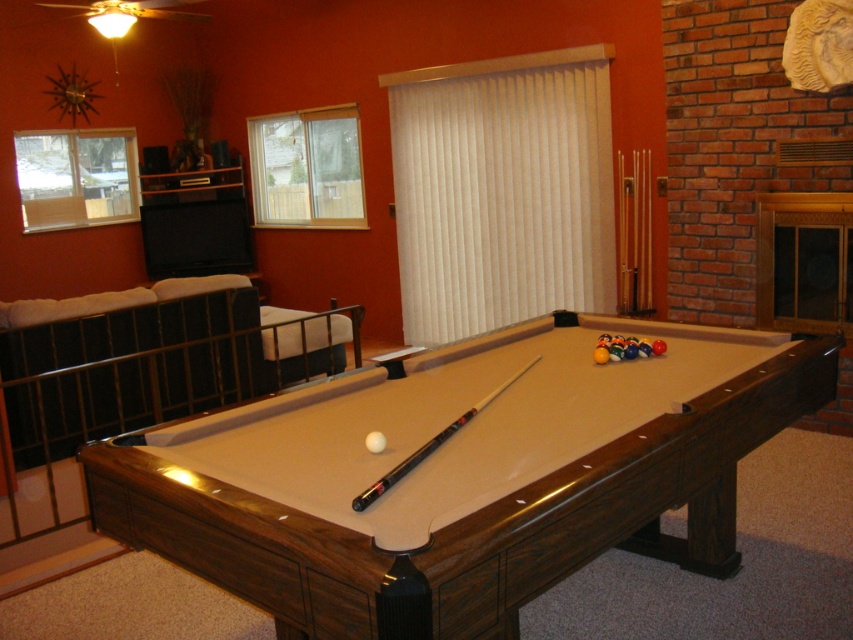
You are standing in the recreational room and want to place a small decorative item on the pool table. You have two options for placement locations, point A at coordinates point (x=389, y=604) and point B at coordinates point (x=520, y=369). Which point is closer to you when viewed from the camera perspective?

Point point (x=389, y=604) is closer to the camera than point point (x=520, y=369), so point A is closer.

You are standing in the recreational room and want to place a 1.5 meter long decorative banner on the floor in front of the brown wood billiard table at center. Can the banner fit entirely in front of the table without overlapping it?

The brown wood billiard table at center is 1.39 meters away from the viewer. Since the banner is 1.5 meters long, it would extend beyond the table, overlapping it. Therefore, the banner cannot fit entirely in front of the table without overlapping.

You are standing in the recreational room and want to place a new decorative item behind the brown wood billiard table at center. Can you put it behind the black wood pool cue at center instead?

The brown wood billiard table at center is in front of the black wood pool cue at center, so placing the item behind the cue would mean placing it behind both objects. However, since the table is already in front of the cue, you can still place the item behind the cue as it is further back than the table.